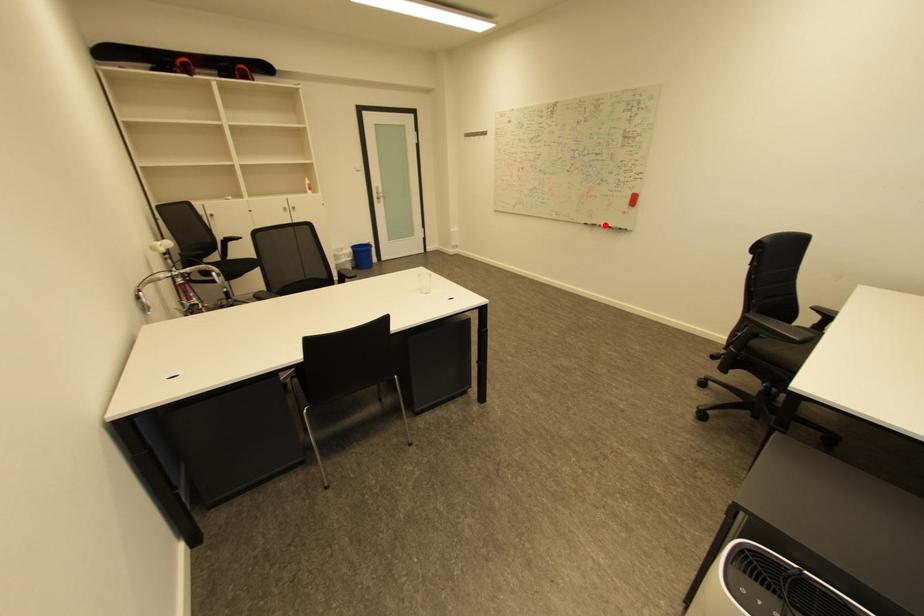
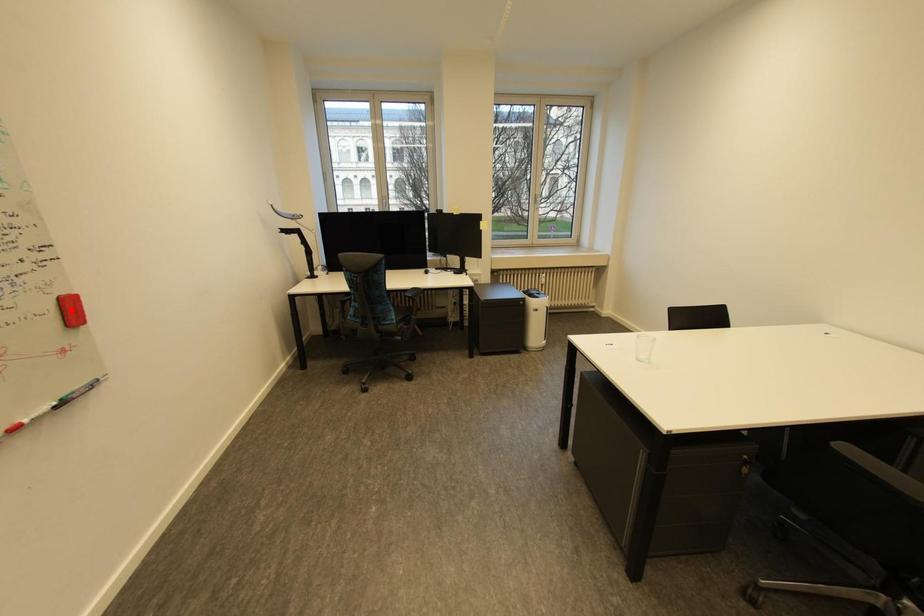
I am providing you with two images of the same scene from different viewpoints. A red point is marked on the first image and another point is marked on the second image. Is the red point in image1 aligned with the point shown in image2?

No